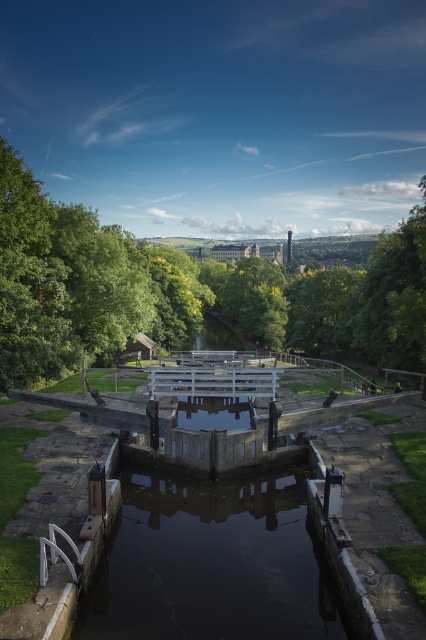
Who is higher up, green leafy tree at center or dark concrete water at center?

green leafy tree at center

Who is taller, green leafy tree at center or dark concrete water at center?

Standing taller between the two is green leafy tree at center.

This screenshot has width=426, height=640. What do you see at coordinates (181, 291) in the screenshot?
I see `green leafy tree at center` at bounding box center [181, 291].

The height and width of the screenshot is (640, 426). In order to click on green leafy tree at center in this screenshot , I will do `click(181, 291)`.